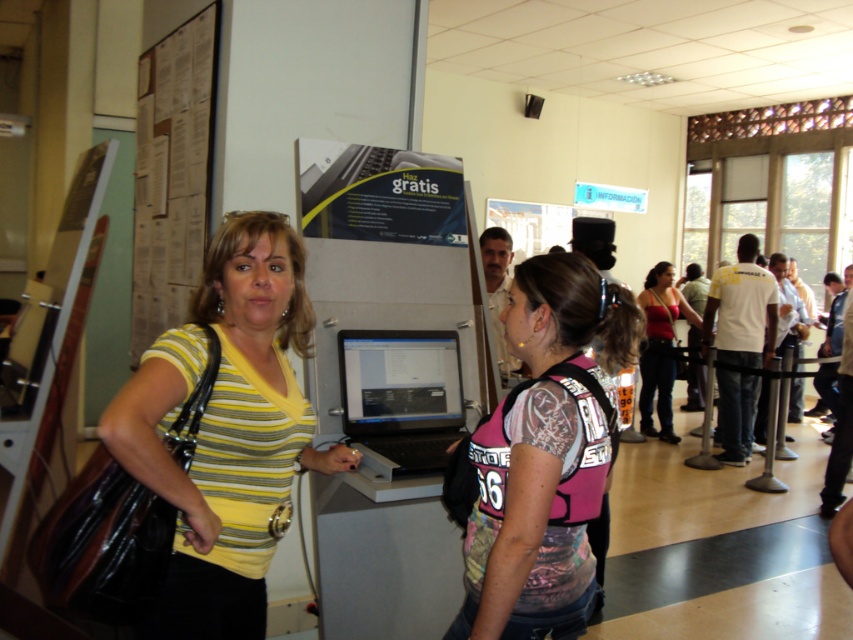
Question: Can you confirm if pink fabric vest at center is positioned above matte black laptop at center?

Choices:
 (A) no
 (B) yes

Answer: (B)

Question: Which object is closer to the camera taking this photo?

Choices:
 (A) matte black laptop at center
 (B) matte red tank top at center
 (C) yellow striped shirt at center

Answer: (C)

Question: Does cardboard posters at upper left have a larger size compared to matte red tank top at center?

Choices:
 (A) yes
 (B) no

Answer: (B)

Question: Which point appears farthest from the camera in this image?

Choices:
 (A) (460, 390)
 (B) (213, 513)
 (C) (660, 420)

Answer: (C)

Question: Does matte black laptop at center appear over matte red tank top at center?

Choices:
 (A) no
 (B) yes

Answer: (A)

Question: Which object is the farthest from the matte red tank top at center?

Choices:
 (A) cardboard posters at upper left
 (B) pink fabric vest at center
 (C) yellow striped shirt at center

Answer: (C)